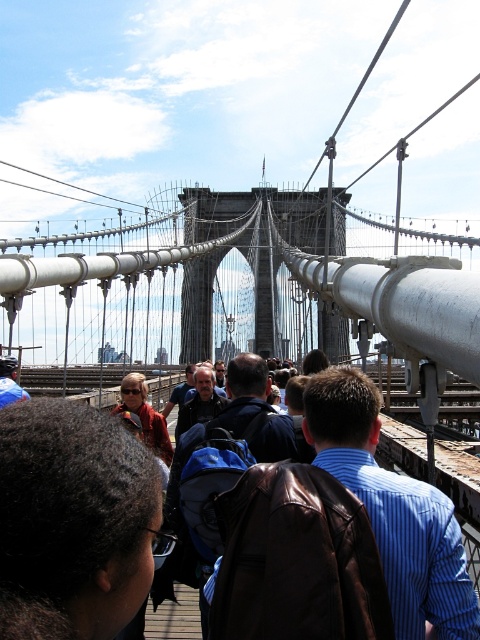
You are standing on the Brooklyn Bridge and see a person with dark brown hair at center. If you want to locate them precisely, what are their coordinates?

The dark brown hair at center is located at coordinates point [72,522].